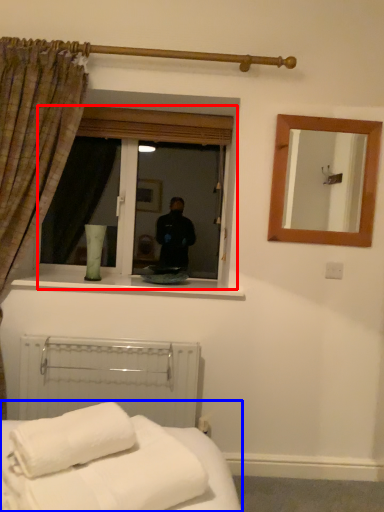
Question: Which point is further to the camera, window (highlighted by a red box) or bed (highlighted by a blue box)?

Choices:
 (A) window
 (B) bed

Answer: (A)